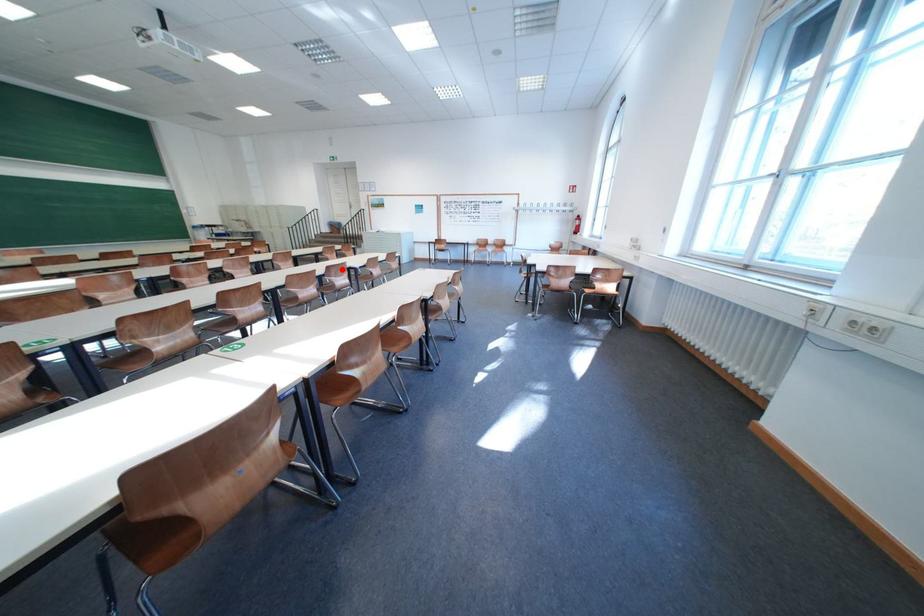
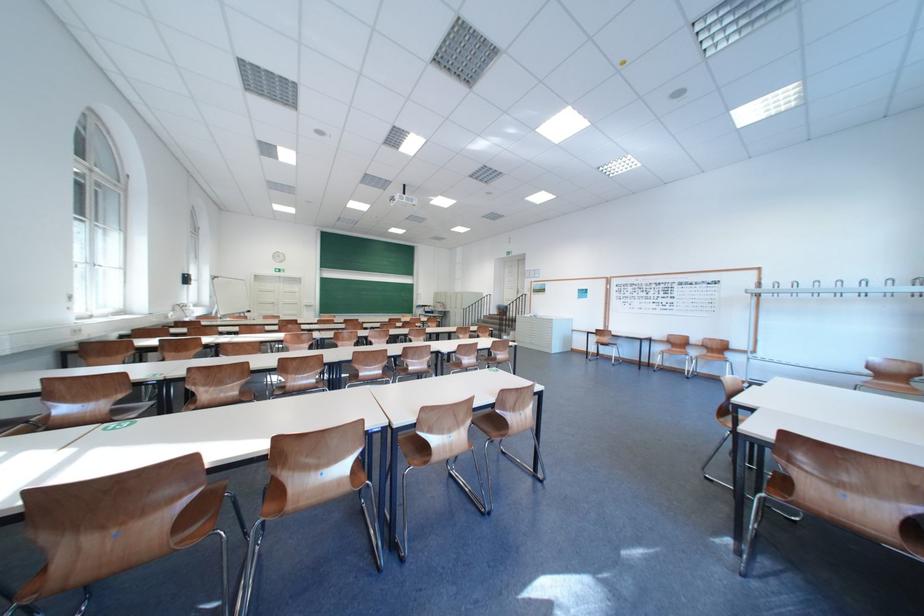
In the second image, find the point that corresponds to the highlighted location in the first image.

(419, 351)